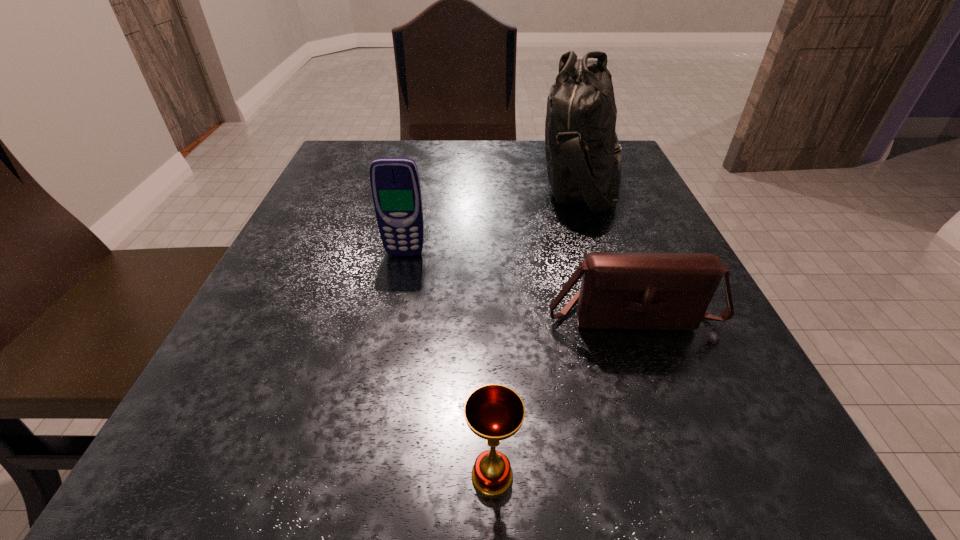
Locate an element on the screen. vacant area located at the front padded panel of the taller shoulder bag is located at coordinates (505, 179).

Where is `free space located 0.330m on the front-facing side of the third nearest object`? The image size is (960, 540). free space located 0.330m on the front-facing side of the third nearest object is located at coordinates (368, 431).

The width and height of the screenshot is (960, 540). What are the coordinates of `vacant region located on the back of the nearest object` in the screenshot? It's located at (491, 399).

Where is `vacant space situated on the front flap of the nearer shoulder bag`? The width and height of the screenshot is (960, 540). vacant space situated on the front flap of the nearer shoulder bag is located at coordinates (678, 441).

What are the coordinates of `object present at the far edge` in the screenshot? It's located at (583, 155).

Identify the location of object that is at the near edge. (494, 412).

Locate an element on the screen. Image resolution: width=960 pixels, height=540 pixels. object at the far right corner is located at coordinates (583, 155).

Image resolution: width=960 pixels, height=540 pixels. What are the coordinates of `blank space at the far edge of the desktop` in the screenshot? It's located at (427, 157).

The height and width of the screenshot is (540, 960). In order to click on free space at the near edge of the desktop in this screenshot , I will do `click(611, 484)`.

In order to click on vacant space at the left edge of the desktop in this screenshot , I will do `click(373, 245)`.